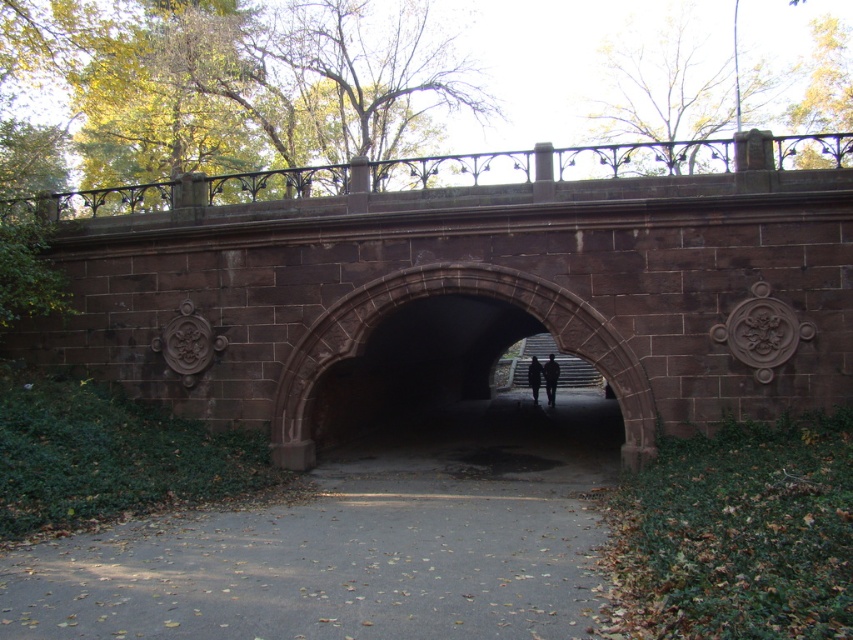
Question: Which object appears closest to the camera in this image?

Choices:
 (A) dark brown stone archway at center
 (B) black matte person at center
 (C) brown stone bridge at center
 (D) dark gray fabric jacket at center

Answer: (C)

Question: Can you confirm if dark gray fabric jacket at center is smaller than black matte person at center?

Choices:
 (A) no
 (B) yes

Answer: (A)

Question: Which of these objects is positioned closest to the gray asphalt path at center?

Choices:
 (A) dark gray fabric jacket at center
 (B) black matte person at center
 (C) brown stone bridge at center

Answer: (C)

Question: Is brown stone bridge at center smaller than gray asphalt path at center?

Choices:
 (A) yes
 (B) no

Answer: (B)

Question: In this image, where is dark brown stone archway at center located relative to black matte person at center?

Choices:
 (A) left
 (B) right

Answer: (A)

Question: Among these points, which one is nearest to the camera?

Choices:
 (A) (537, 371)
 (B) (260, 545)
 (C) (379, 301)
 (D) (701, 225)

Answer: (B)